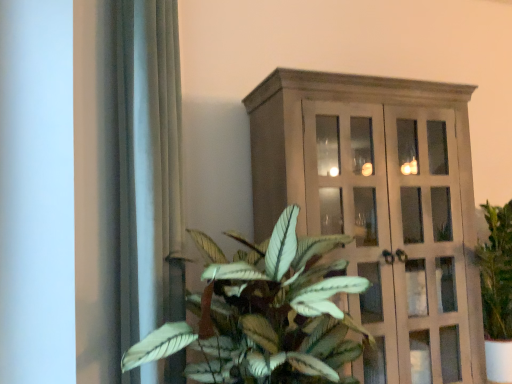
Measure the distance between wooden cabinet at upper center and camera.

wooden cabinet at upper center is 1.58 meters away from camera.

Find the location of `wooden cabinet at upper center`. wooden cabinet at upper center is located at coordinates (381, 208).

Locate an element on the screen. The image size is (512, 384). green leafy plant at center is located at coordinates (265, 314).

Measure the distance between point (291, 265) and camera.

Point (291, 265) is 1.34 meters away from camera.

You are a GUI agent. You are given a task and a screenshot of the screen. Output one action in this format:
    pyautogui.click(x=<x>, y=<y>)
    Task: Click on the matte wooden cabinet at right
    The width and height of the screenshot is (512, 384).
    Given the screenshot: What is the action you would take?
    pyautogui.click(x=426, y=245)

Describe the element at coordinates (149, 167) in the screenshot. The height and width of the screenshot is (384, 512). I see `satin gray curtain at left` at that location.

Where is `wooden cabinet at upper center`? The image size is (512, 384). wooden cabinet at upper center is located at coordinates (381, 208).

Considering the points (434, 207) and (315, 313), which point is behind, point (434, 207) or point (315, 313)?

The point (434, 207) is more distant.

Would you say wooden cabinet at upper center is a long distance from green leafy plant at center?

No, wooden cabinet at upper center is in close proximity to green leafy plant at center.

Would you say wooden cabinet at upper center is to the left or to the right of green leafy plant at center in the picture?

Based on their positions, wooden cabinet at upper center is located to the right of green leafy plant at center.

From the image's perspective, between green leafy plant at center and wooden cabinet at upper center, who is located below?

From the image's view, green leafy plant at center is below.

From a real-world perspective, who is located higher, green leafy plant at center or wooden cabinet at upper center?

wooden cabinet at upper center, from a real-world perspective.

Locate an element on the screen. houseplant in front of the wooden cabinet at upper center is located at coordinates (265, 314).

Is green leafy plant at center not close to satin gray curtain at left?

They are positioned close to each other.

From the image's perspective, is green leafy plant at center above or below satin gray curtain at left?

green leafy plant at center is below satin gray curtain at left.

Which of these two, green leafy plant at center or satin gray curtain at left, is wider?

With larger width is green leafy plant at center.

Are wooden cabinet at upper center and matte wooden cabinet at right far apart?

No, there isn't a large distance between wooden cabinet at upper center and matte wooden cabinet at right.

How many degrees apart are the facing directions of wooden cabinet at upper center and matte wooden cabinet at right?

The angular difference between wooden cabinet at upper center and matte wooden cabinet at right is 1.83 degrees.

Which of these two, wooden cabinet at upper center or matte wooden cabinet at right, is thinner?

wooden cabinet at upper center is thinner.

From their relative heights in the image, would you say matte wooden cabinet at right is taller or shorter than wooden cabinet at upper center?

Considering their sizes, matte wooden cabinet at right has less height than wooden cabinet at upper center.

How far apart are matte wooden cabinet at right and wooden cabinet at upper center?

They are 4.17 inches apart.

From the image's perspective, which object appears higher, matte wooden cabinet at right or wooden cabinet at upper center?

wooden cabinet at upper center, from the image's perspective.

Is matte wooden cabinet at right to the left or to the right of wooden cabinet at upper center in the image?

From the image, it's evident that matte wooden cabinet at right is to the right of wooden cabinet at upper center.

From the image's perspective, who appears lower, wooden cabinet at upper center or satin gray curtain at left?

wooden cabinet at upper center.

Does point (438, 217) come behind point (130, 21)?

Yes, point (438, 217) is behind point (130, 21).

Which is correct: green leafy plant at center is inside matte wooden cabinet at right, or outside of it?

green leafy plant at center is located beyond the bounds of matte wooden cabinet at right.

Is there a large distance between green leafy plant at center and matte wooden cabinet at right?

No.

From a real-world perspective, between green leafy plant at center and matte wooden cabinet at right, who is vertically higher?

From a 3D spatial view, matte wooden cabinet at right is above.

Where is `cupboard located behind the green leafy plant at center`? The width and height of the screenshot is (512, 384). cupboard located behind the green leafy plant at center is located at coordinates (381, 208).

Identify the location of cupboard located above the green leafy plant at center (from the image's perspective). Image resolution: width=512 pixels, height=384 pixels. (381, 208).

When comparing their distances from satin gray curtain at left, does matte wooden cabinet at right or wooden cabinet at upper center seem closer?

wooden cabinet at upper center is closer to satin gray curtain at left.

When comparing their distances from matte wooden cabinet at right, does wooden cabinet at upper center or green leafy plant at center seem further?

green leafy plant at center lies further to matte wooden cabinet at right than the other object.

Considering their positions, is green leafy plant at center positioned closer to satin gray curtain at left than wooden cabinet at upper center?

The object closer to satin gray curtain at left is green leafy plant at center.

Based on their spatial positions, is satin gray curtain at left or wooden cabinet at upper center further from green leafy plant at center?

Based on the image, wooden cabinet at upper center appears to be further to green leafy plant at center.

Estimate the real-world distances between objects in this image. Which object is closer to wooden cabinet at upper center, green leafy plant at center or matte wooden cabinet at right?

matte wooden cabinet at right lies closer to wooden cabinet at upper center than the other object.

From the image, which object appears to be nearer to matte wooden cabinet at right, green leafy plant at center or satin gray curtain at left?

Among the two, green leafy plant at center is located nearer to matte wooden cabinet at right.

Based on the photo, looking at the image, which one is located closer to green leafy plant at center, satin gray curtain at left or matte wooden cabinet at right?

satin gray curtain at left is closer to green leafy plant at center.

Based on their spatial positions, is satin gray curtain at left or wooden cabinet at upper center closer to matte wooden cabinet at right?

wooden cabinet at upper center is closer to matte wooden cabinet at right.

Locate an element on the screen. houseplant between satin gray curtain at left and wooden cabinet at upper center in the horizontal direction is located at coordinates (265, 314).

Where is `houseplant located between satin gray curtain at left and matte wooden cabinet at right in the left-right direction`? houseplant located between satin gray curtain at left and matte wooden cabinet at right in the left-right direction is located at coordinates (265, 314).

Find the location of `cupboard located between green leafy plant at center and matte wooden cabinet at right in the left-right direction`. cupboard located between green leafy plant at center and matte wooden cabinet at right in the left-right direction is located at coordinates (381, 208).

The image size is (512, 384). Find the location of `cupboard between satin gray curtain at left and matte wooden cabinet at right`. cupboard between satin gray curtain at left and matte wooden cabinet at right is located at coordinates (381, 208).